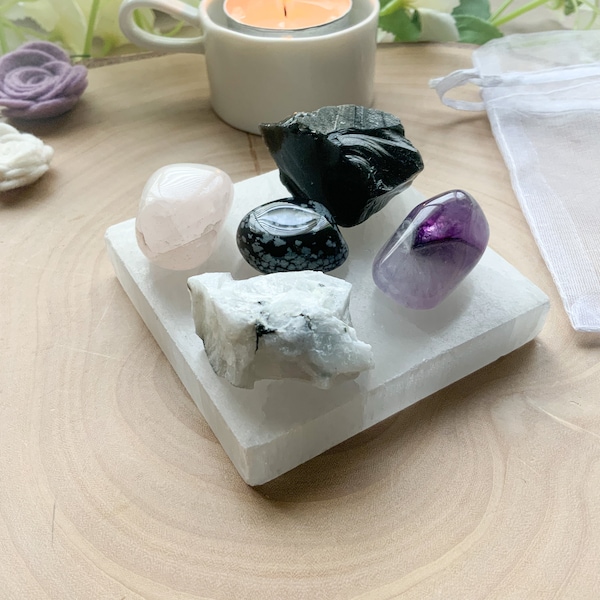
Where is `clear case for crystals`? The height and width of the screenshot is (600, 600). clear case for crystals is located at coordinates pos(554,161).